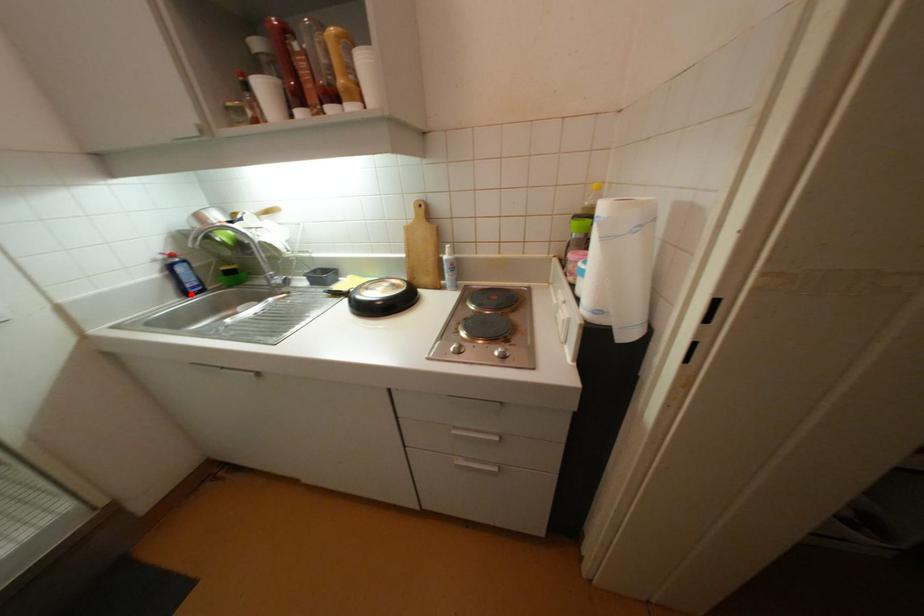
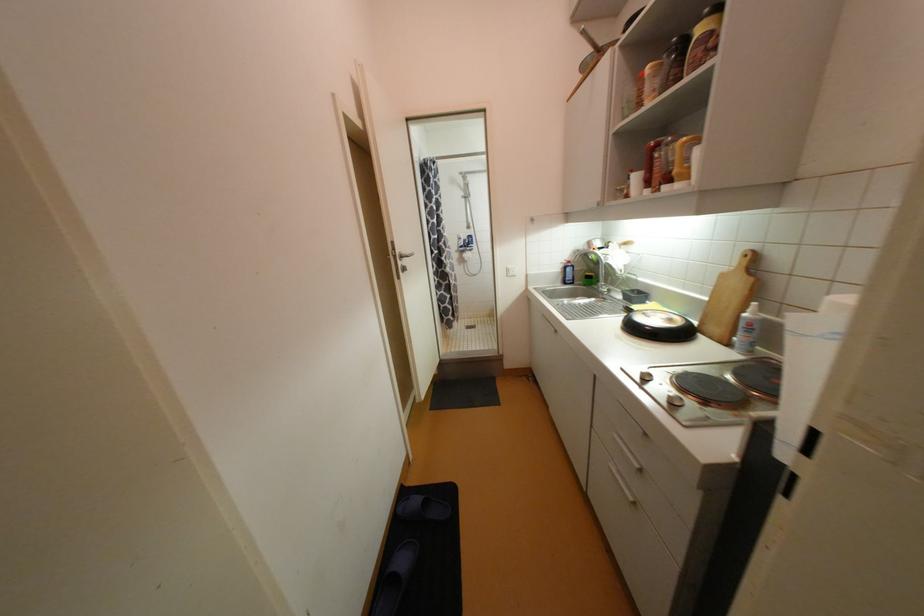
Find the pixel in the second image that matches the highlighted location in the first image.

(569, 283)